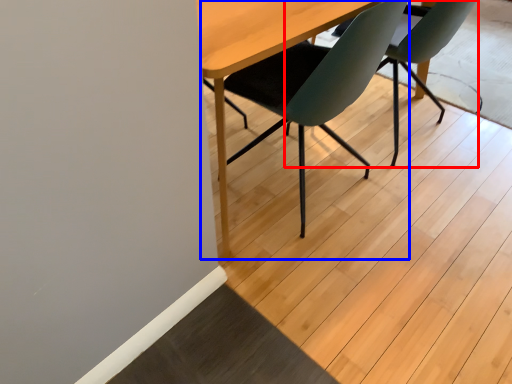
Question: Among these objects, which one is farthest to the camera, chair (highlighted by a red box) or chair (highlighted by a blue box)?

Choices:
 (A) chair
 (B) chair

Answer: (A)